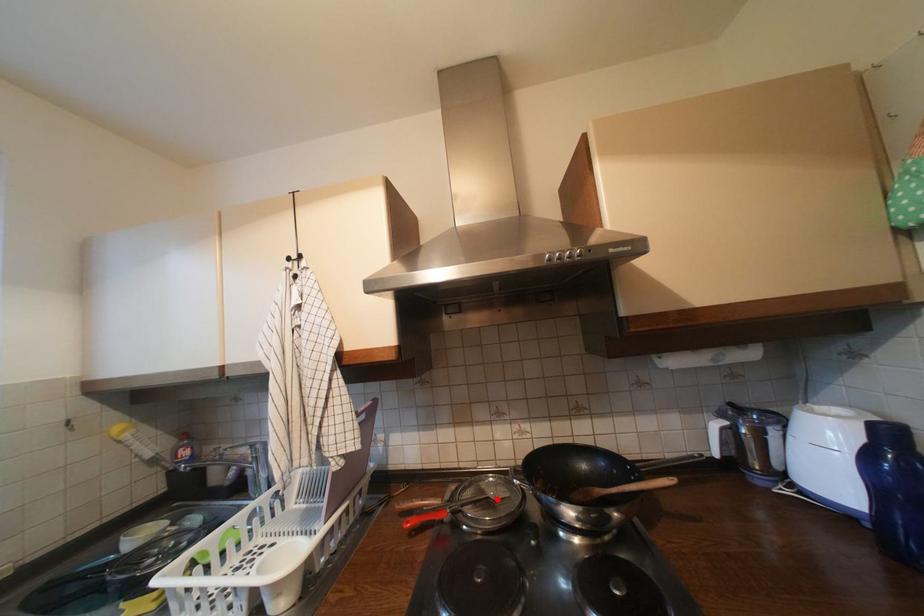
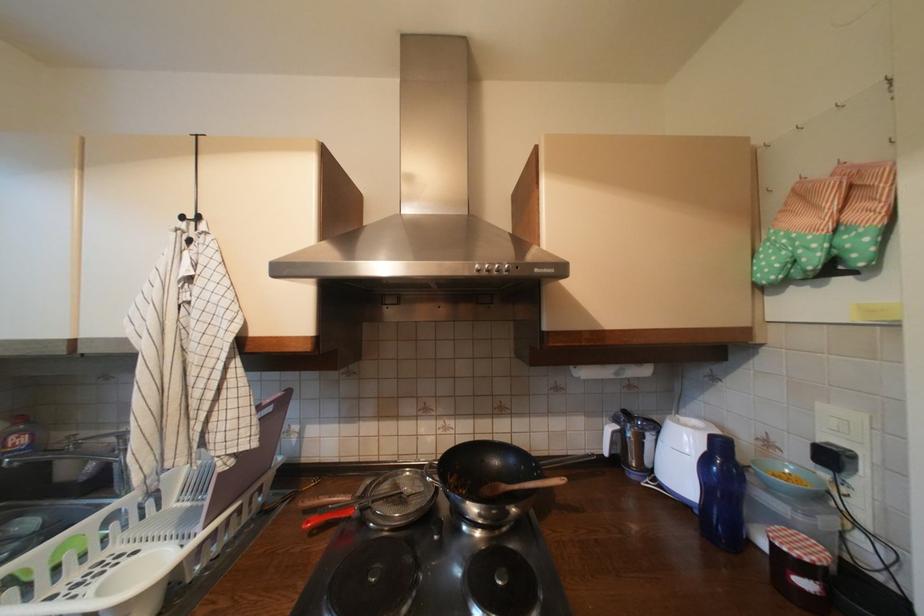
Find the pixel in the second image that matches the highlighted location in the first image.

(410, 495)